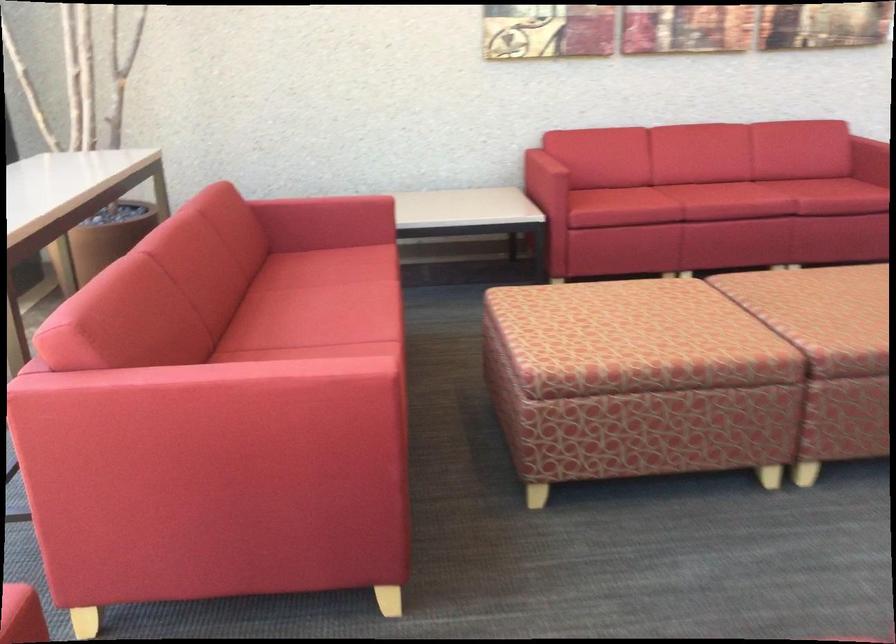
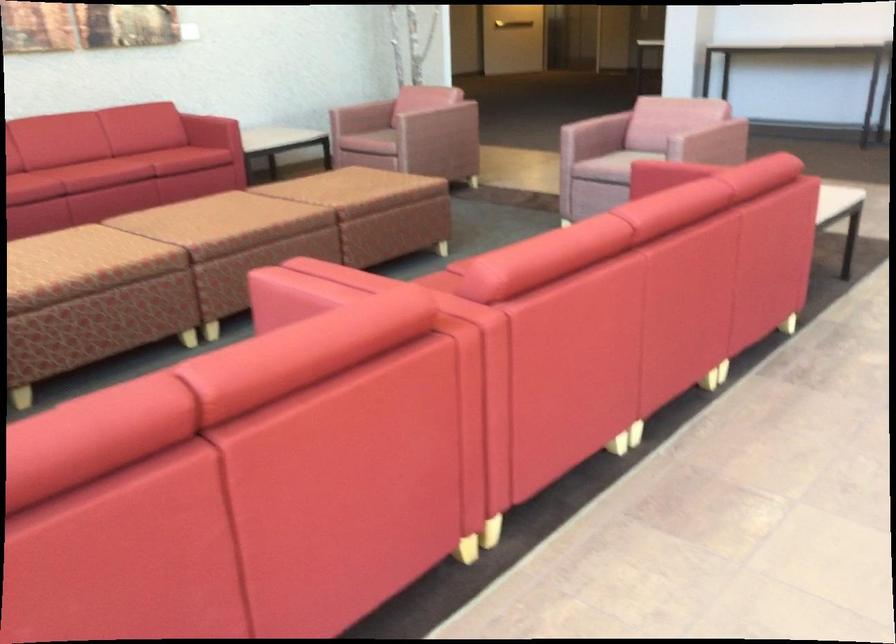
Where in the second image is the point corresponding to pixel 655 348 from the first image?

(83, 265)